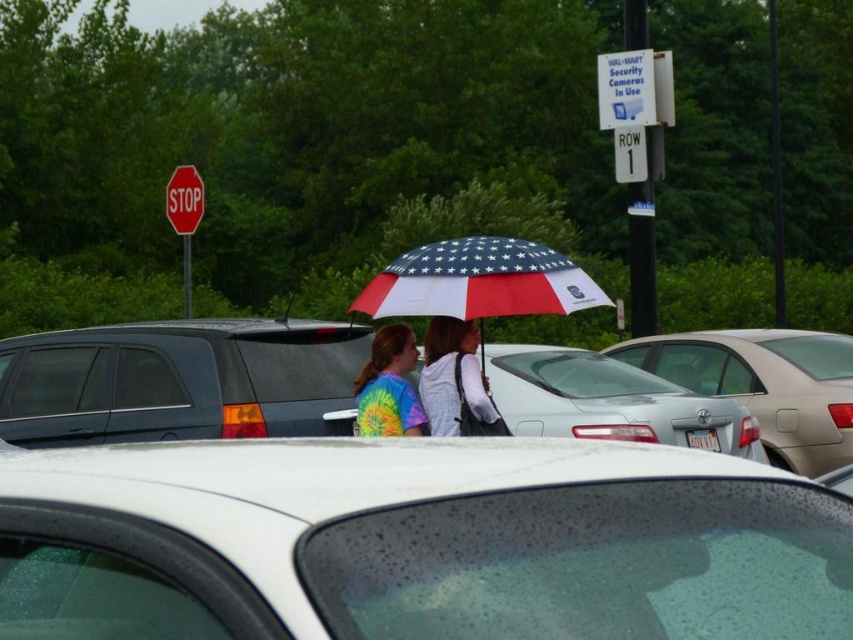
Does white matte car at center appear on the right side of silver metallic sedan at center-right?

Incorrect, white matte car at center is not on the right side of silver metallic sedan at center-right.

Is point (654, 632) less distant than point (827, 332)?

That is True.

Find the location of a particular element. The height and width of the screenshot is (640, 853). white matte car at center is located at coordinates (418, 541).

Between white matte car at center and matte white hoodie at center, which one has more height?

matte white hoodie at center is taller.

Which is behind, point (450, 602) or point (440, 355)?

The point (440, 355) is behind.

This screenshot has width=853, height=640. What are the coordinates of `white matte car at center` in the screenshot? It's located at (418, 541).

Measure the distance between american flag-patterned umbrella at center and camera.

6.42 meters

This screenshot has width=853, height=640. I want to click on american flag-patterned umbrella at center, so click(x=479, y=282).

Where is `american flag-patterned umbrella at center`? This screenshot has width=853, height=640. american flag-patterned umbrella at center is located at coordinates (479, 282).